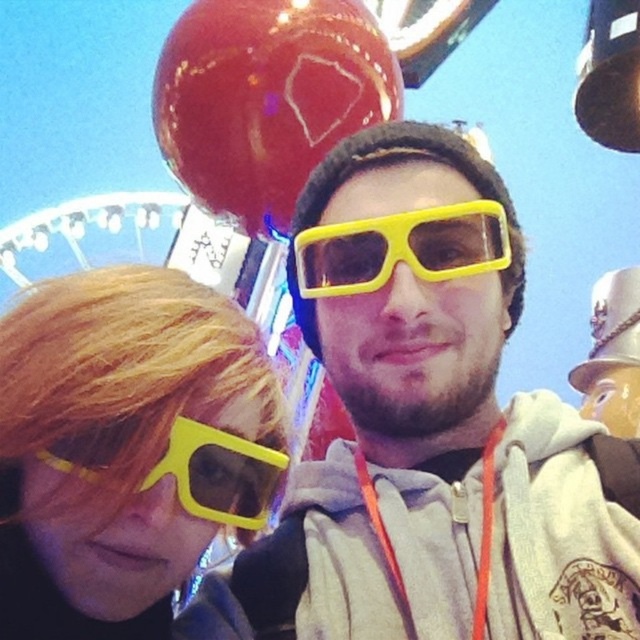
You are standing at the camera position and want to hand a pair of matte yellow sunglasses at left to someone who is 6 feet tall. If the average human arm length is 2.5 feet, can you reach them without moving?

The matte yellow sunglasses at left are 58.93 feet away from the camera. Since the average arm length is only 2.5 feet, you cannot reach the matte yellow sunglasses at left from the current position.

You are standing at the point with coordinates point (280, 216) and want to walk to the point (220, 429). Which direction should you move to get closer to your destination?

To move from point (280, 216) to point (220, 429), you should move northeast because the destination has a higher x coordinate and lower y coordinate, indicating a northeast direction.

You are a photographer trying to capture a photo of the glossy red balloon at upper center and the yellow matte sunglasses at lower left. Which object should you focus on first if you want to ensure both are in the frame without moving the camera? Explain your reasoning based on their sizes.

The glossy red balloon at upper center should be focused on first because it is larger than the yellow matte sunglasses at lower left. Since it takes up more space in the frame, ensuring its proper focus will naturally include the smaller sunglasses in the composition without needing to adjust the camera position.